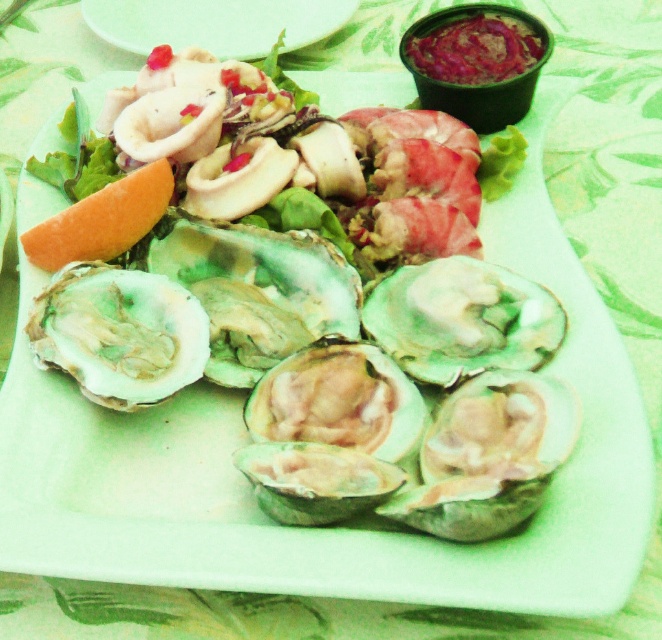
Does point (93, 317) lie behind point (160, 4)?

No, it is not.

Does point (124, 387) come closer to viewer compared to point (238, 51)?

Yes, point (124, 387) is closer to viewer.

Locate an element on the screen. The height and width of the screenshot is (640, 662). greenish shell oyster at center is located at coordinates coord(118,333).